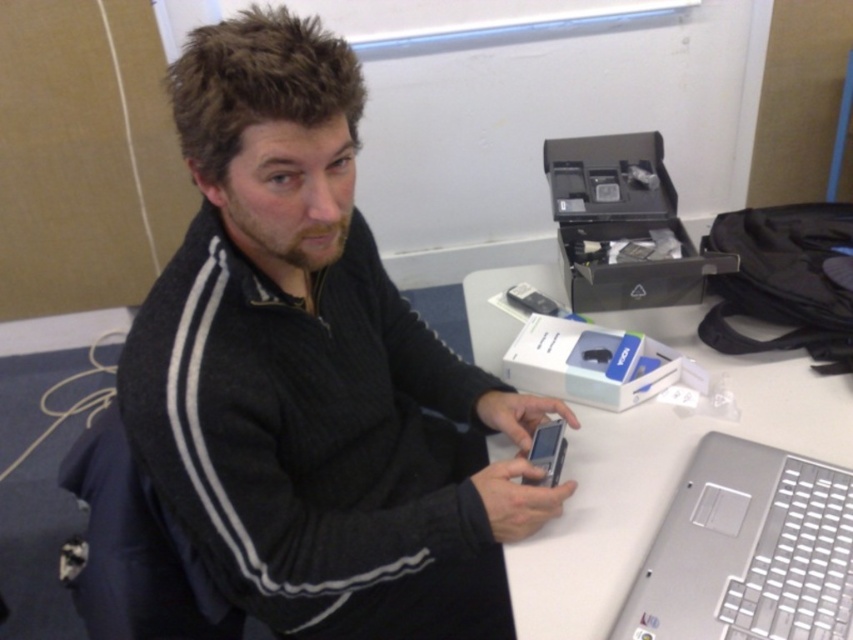
You have a small electronic device that is the same size as the satin silver phone at center. You want to place it on the silver metallic table at center. Will it fit without hanging over the edge? Please explain your reasoning.

The silver metallic table at center has a larger width than the satin silver phone at center, so placing the device of the same size should fit without overhanging since the table is wider.

From the picture: You are a photographer who needs to capture a closeup of the satin silver phone at center. However, you notice the black matte sweater at upper left might block your view. Based on their sizes, do you think the sweater will obscure the phone?

The black matte sweater at upper left is much taller than the satin silver phone at center, so it will likely block the view of the phone.

You are organizing items on the desk and need to place the satin silver phone at center on top of the silver metallic table at center. Is this possible given their sizes?

The silver metallic table at center is larger in size than the satin silver phone at center, so yes, the satin silver phone at center can be placed on top of the silver metallic table at center since it is smaller in size.